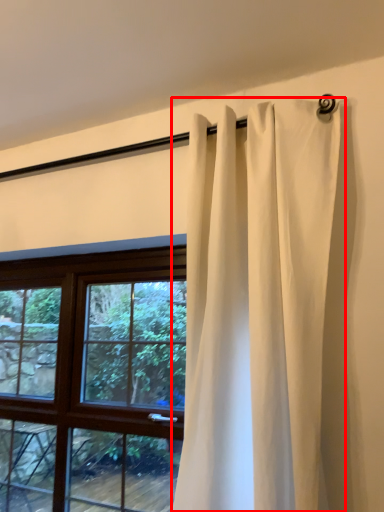
Question: From the image, what is the correct spatial relationship of curtain (annotated by the red box) in relation to window?

Choices:
 (A) right
 (B) left

Answer: (A)